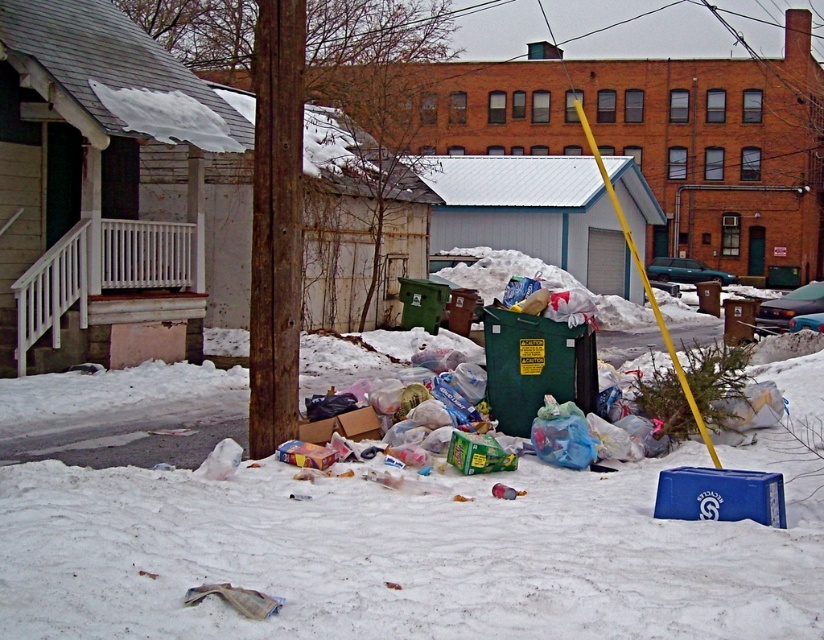
You are a delivery person trying to navigate through the snowy area. You see the white fluffy snow at lower center and the rusty wood pole at center. Which path has a narrower width for your delivery vehicle?

The white fluffy snow at lower center has a narrower width than the rusty wood pole at center, so the path through the white fluffy snow at lower center is narrower for your delivery vehicle.